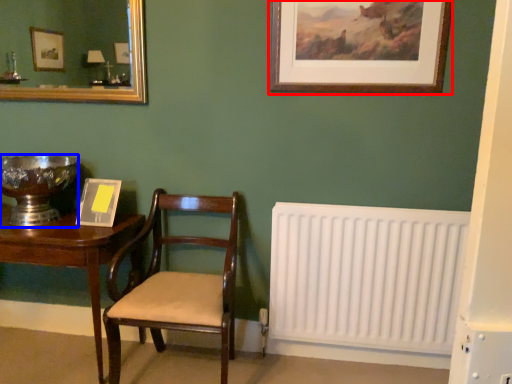
Question: Which of the following is the farthest to the observer, picture frame (highlighted by a red box) or glass bowl (highlighted by a blue box)?

Choices:
 (A) picture frame
 (B) glass bowl

Answer: (B)